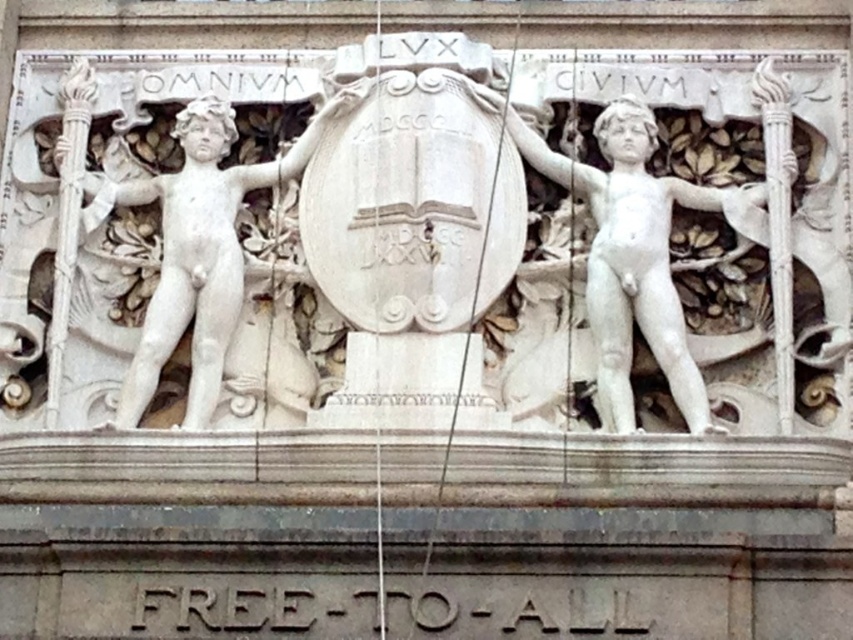
You are an art conservator assessing the stone relief sculpture. You notice that the white marble statue at left and the white marble statue at right are both holding different items. Based on their sizes, which statue might be more challenging to clean thoroughly? Explain your reasoning.

The white marble statue at right is larger in size than the white marble statue at left. Therefore, the statue at right may be more challenging to clean thoroughly due to its increased size requiring more effort and possibly harder to reach areas.

You are an art conservator assessing the stone relief sculpture. You notice that the white marble statue at left and the white marble statue at right have different heights. Based on the scene description, which statue is taller?

The white marble statue at right is taller than the white marble statue at left according to the description.

You are an art conservator examining the stone relief sculpture. You need to clean both the white marble statue at right and the white marble statue at left. Which statue should you start with if you want to work on the one closer to you first?

The white marble statue at right is closer to the viewer, so you should start with the white marble statue at right first.